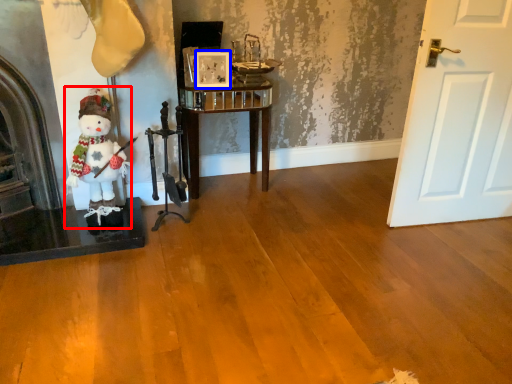
Question: Which object is closer to the camera taking this photo, figurine (highlighted by a red box) or picture frame (highlighted by a blue box)?

Choices:
 (A) figurine
 (B) picture frame

Answer: (A)